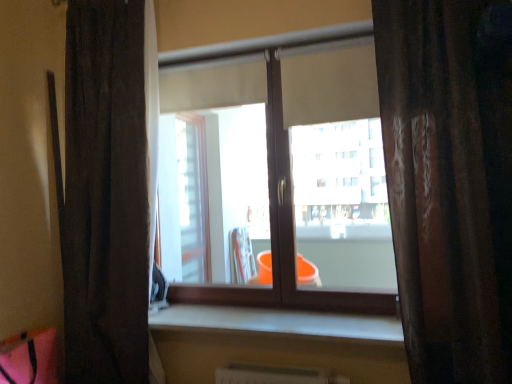
Question: Would you say brown textured curtain at right, arranged as the 2th curtain when viewed from the back, is a long distance from dark fabric curtain at left, which ranks as the second curtain in front-to-back order?

Choices:
 (A) no
 (B) yes

Answer: (B)

Question: Is dark fabric curtain at left, placed as the 1th curtain when sorted from back to front, completely or partially inside brown textured curtain at right, the second curtain when ordered from left to right?

Choices:
 (A) no
 (B) yes

Answer: (A)

Question: From the image's perspective, is brown textured curtain at right, acting as the 1th curtain starting from the right, located above dark fabric curtain at left, the 2th curtain in the right-to-left sequence?

Choices:
 (A) no
 (B) yes

Answer: (B)

Question: From a real-world perspective, is brown textured curtain at right, acting as the 1th curtain starting from the right, located higher than dark fabric curtain at left, placed as the 1th curtain when sorted from back to front?

Choices:
 (A) yes
 (B) no

Answer: (B)

Question: Is brown textured curtain at right, the first curtain from the front, bigger than dark fabric curtain at left, the 2th curtain in the right-to-left sequence?

Choices:
 (A) no
 (B) yes

Answer: (B)

Question: Is brown textured curtain at right, the first curtain from the front, thinner than dark fabric curtain at left, which ranks as the second curtain in front-to-back order?

Choices:
 (A) no
 (B) yes

Answer: (A)

Question: Is smooth concrete window sill at center not close to brown textured curtain at right, the first curtain from the front?

Choices:
 (A) yes
 (B) no

Answer: (B)

Question: Is smooth concrete window sill at center bigger than brown textured curtain at right, arranged as the 2th curtain when viewed from the back?

Choices:
 (A) yes
 (B) no

Answer: (B)

Question: Is smooth concrete window sill at center positioned before brown textured curtain at right, the second curtain when ordered from left to right?

Choices:
 (A) no
 (B) yes

Answer: (A)

Question: Is smooth concrete window sill at center at the right side of brown textured curtain at right, the second curtain when ordered from left to right?

Choices:
 (A) no
 (B) yes

Answer: (A)

Question: Is smooth concrete window sill at center shorter than brown textured curtain at right, the second curtain when ordered from left to right?

Choices:
 (A) no
 (B) yes

Answer: (B)

Question: Could you tell me if smooth concrete window sill at center is turned towards brown textured curtain at right, the second curtain when ordered from left to right?

Choices:
 (A) yes
 (B) no

Answer: (B)

Question: From the image's perspective, is dark fabric curtain at left, which ranks as the second curtain in front-to-back order, located beneath brown textured curtain at right, arranged as the 2th curtain when viewed from the back?

Choices:
 (A) yes
 (B) no

Answer: (A)